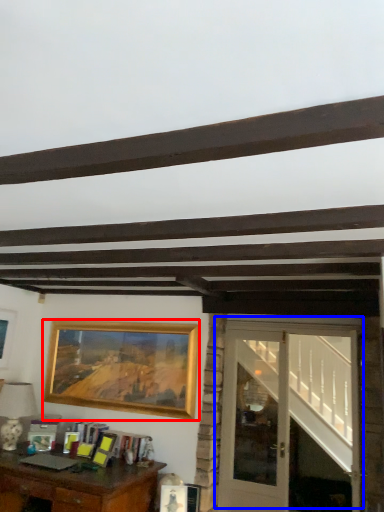
Question: Among these objects, which one is nearest to the camera, picture frame (highlighted by a red box) or door (highlighted by a blue box)?

Choices:
 (A) picture frame
 (B) door

Answer: (B)